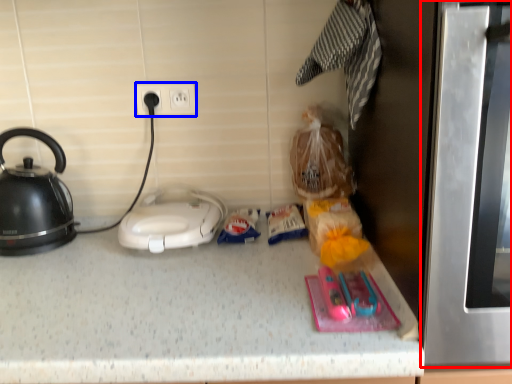
Question: Which point is further to the camera, oven (highlighted by a red box) or electric outlet (highlighted by a blue box)?

Choices:
 (A) oven
 (B) electric outlet

Answer: (B)